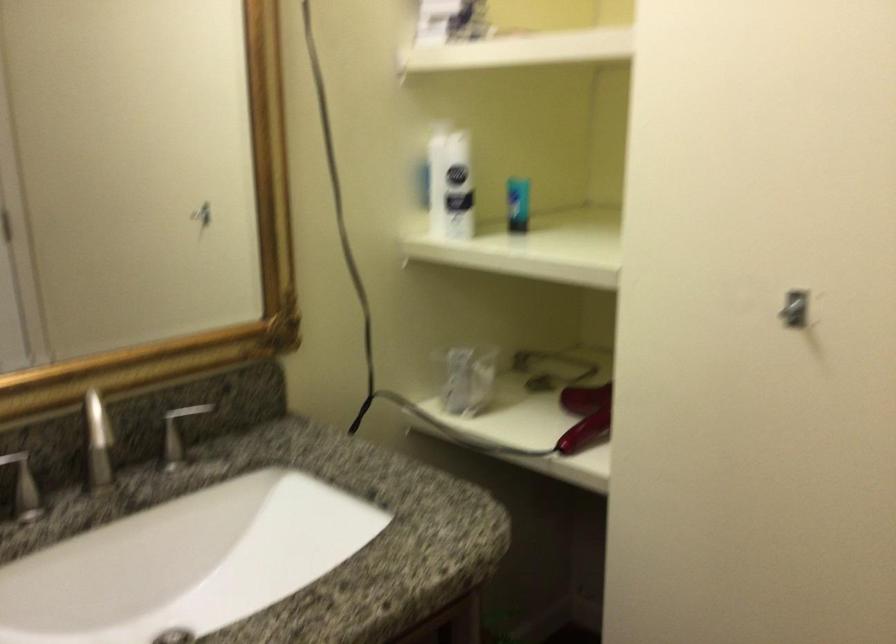
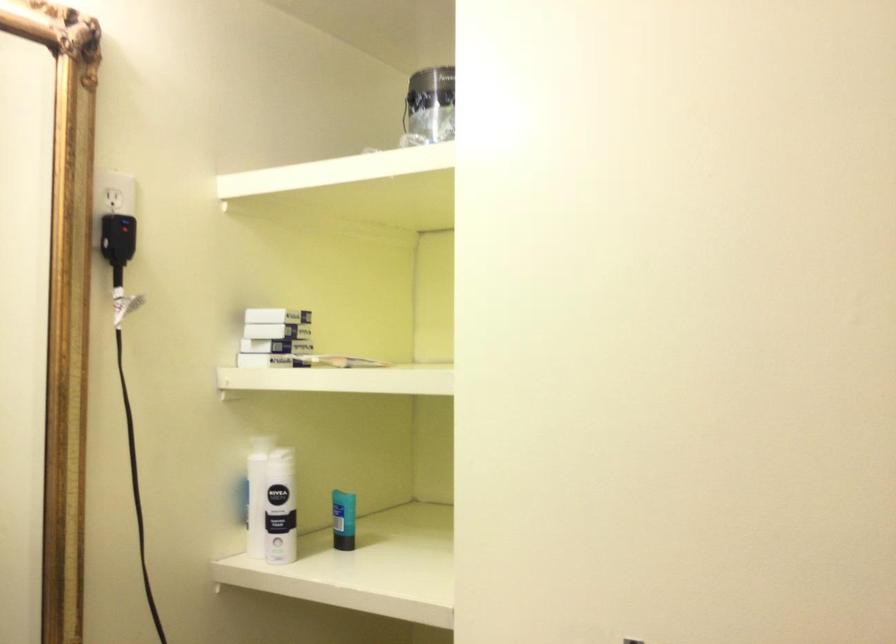
Where in the second image is the point corresponding to pixel 458 182 from the first image?

(271, 504)